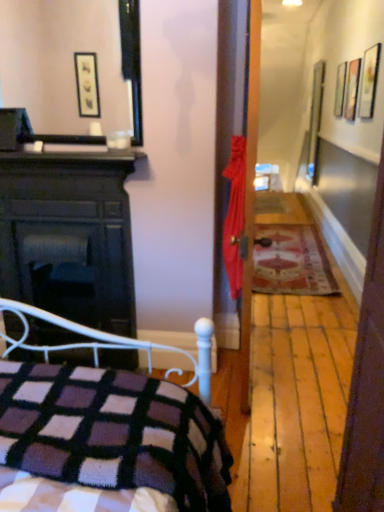
I want to click on vacant space situated above knitted wool blanket at lower left (from a real-world perspective), so click(70, 421).